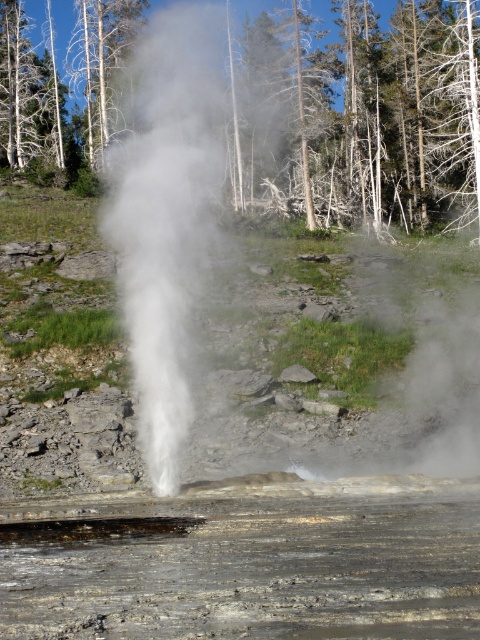
Who is positioned more to the left, dead wood tree at center or white vapor at center?

From the viewer's perspective, white vapor at center appears more on the left side.

Locate an element on the screen. This screenshot has width=480, height=640. dead wood tree at center is located at coordinates (372, 115).